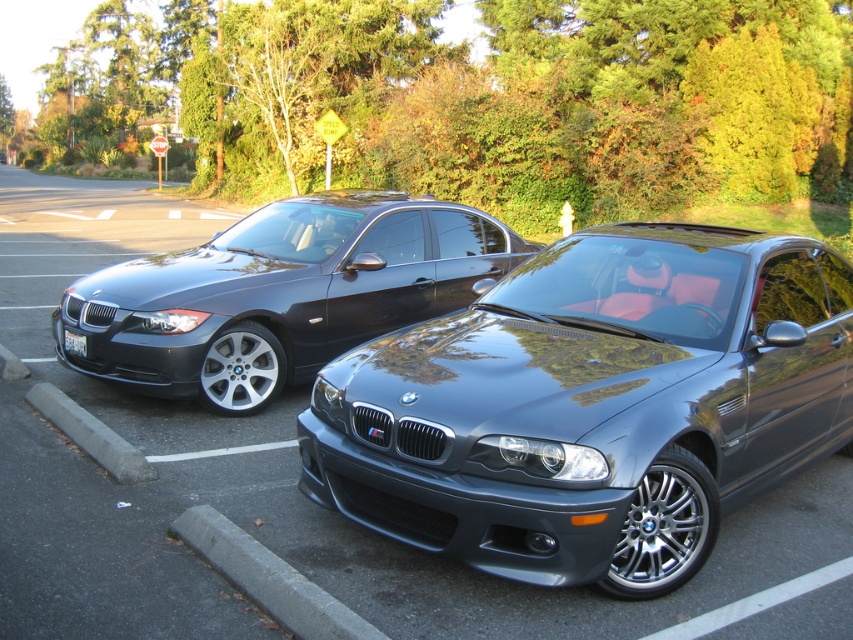
Which of these two, satin metallic car at center or satin black sedan at left, stands taller?

With more height is satin black sedan at left.

Which is in front, point (573, 339) or point (323, 232)?

Point (573, 339)

Which is behind, point (683, 540) or point (300, 304)?

Positioned behind is point (300, 304).

This screenshot has width=853, height=640. I want to click on satin metallic car at center, so click(x=593, y=404).

Consider the image. Is the position of satin black sedan at left more distant than that of white plastic license plate at lower left?

No, it is not.

Does satin black sedan at left appear on the left side of white plastic license plate at lower left?

Incorrect, satin black sedan at left is not on the left side of white plastic license plate at lower left.

Image resolution: width=853 pixels, height=640 pixels. I want to click on satin black sedan at left, so click(280, 292).

Is point (242, 333) closer to viewer compared to point (312, 637)?

That is False.

Is satin black sedan at left closer to camera compared to gray concrete curb at lower center?

No, it is not.

Between point (252, 296) and point (294, 616), which one is positioned behind?

Point (252, 296)

You are a GUI agent. You are given a task and a screenshot of the screen. Output one action in this format:
    pyautogui.click(x=<x>, y=<y>)
    Task: Click on the satin black sedan at left
    
    Given the screenshot: What is the action you would take?
    pyautogui.click(x=280, y=292)